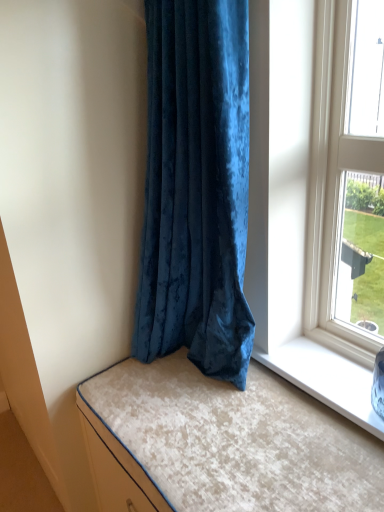
Question: Does velvet blue curtain at center lie in front of velvet beige cushion at lower left?

Choices:
 (A) no
 (B) yes

Answer: (A)

Question: Considering the relative sizes of velvet blue curtain at center and velvet beige cushion at lower left in the image provided, is velvet blue curtain at center wider than velvet beige cushion at lower left?

Choices:
 (A) no
 (B) yes

Answer: (A)

Question: Considering the relative positions of velvet blue curtain at center and velvet beige cushion at lower left in the image provided, is velvet blue curtain at center behind velvet beige cushion at lower left?

Choices:
 (A) yes
 (B) no

Answer: (A)

Question: Considering the relative sizes of velvet blue curtain at center and velvet beige cushion at lower left in the image provided, is velvet blue curtain at center taller than velvet beige cushion at lower left?

Choices:
 (A) yes
 (B) no

Answer: (A)

Question: Is velvet blue curtain at center thinner than velvet beige cushion at lower left?

Choices:
 (A) yes
 (B) no

Answer: (A)

Question: Is there a large distance between velvet blue curtain at center and velvet beige cushion at lower left?

Choices:
 (A) yes
 (B) no

Answer: (B)

Question: Considering the relative sizes of velvet beige cushion at lower left and velvet blue curtain at center in the image provided, is velvet beige cushion at lower left wider than velvet blue curtain at center?

Choices:
 (A) no
 (B) yes

Answer: (B)

Question: Is velvet blue curtain at center at the back of velvet beige cushion at lower left?

Choices:
 (A) no
 (B) yes

Answer: (A)

Question: Is velvet beige cushion at lower left located outside velvet blue curtain at center?

Choices:
 (A) yes
 (B) no

Answer: (A)

Question: Is velvet beige cushion at lower left further to the viewer compared to velvet blue curtain at center?

Choices:
 (A) no
 (B) yes

Answer: (A)

Question: From the image's perspective, is velvet beige cushion at lower left under velvet blue curtain at center?

Choices:
 (A) yes
 (B) no

Answer: (A)

Question: From a real-world perspective, is velvet beige cushion at lower left beneath velvet blue curtain at center?

Choices:
 (A) no
 (B) yes

Answer: (B)

Question: In terms of width, does velvet beige cushion at lower left look wider or thinner when compared to velvet blue curtain at center?

Choices:
 (A) thin
 (B) wide

Answer: (B)